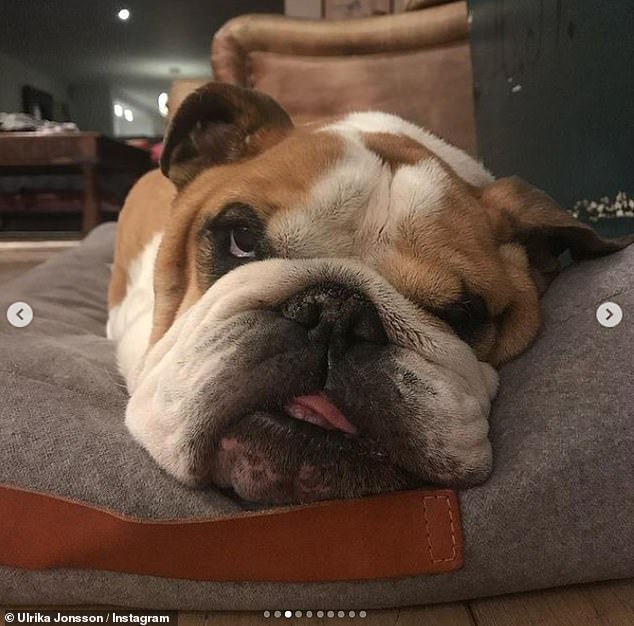
Locate an element on the screen. leather chair arm is located at coordinates (359, 58).